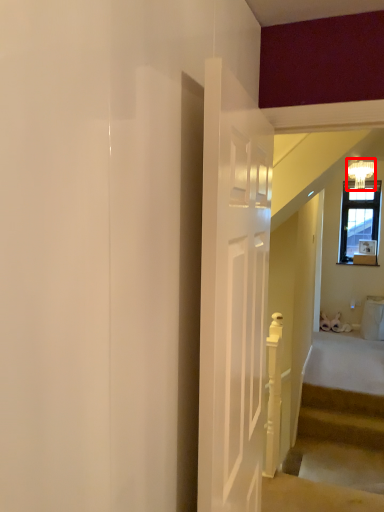
Question: Considering the relative positions of light fixture (annotated by the red box) and stairs in the image provided, where is light fixture (annotated by the red box) located with respect to the staircase?

Choices:
 (A) right
 (B) left

Answer: (A)